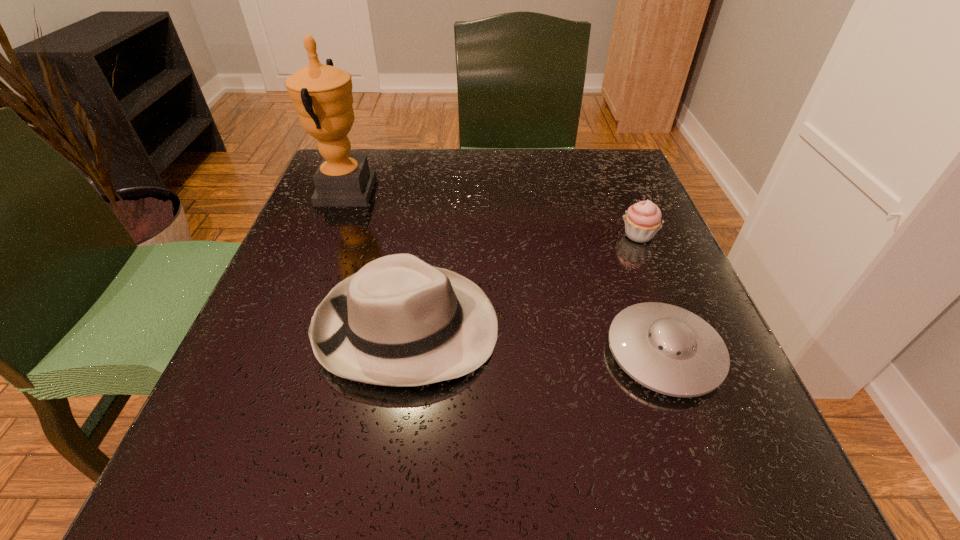
At what (x,y) coordinates should I click in order to perform the action: click on vacant area at the near left corner of the desktop. Please return your answer as a coordinate pair (x, y). The width and height of the screenshot is (960, 540). Looking at the image, I should click on (213, 451).

At what (x,y) coordinates should I click in order to perform the action: click on vacant space at the far right corner of the desktop. Please return your answer as a coordinate pair (x, y). Image resolution: width=960 pixels, height=540 pixels. Looking at the image, I should click on (571, 159).

Where is `free area in between the shortest object and the farthest object`? This screenshot has width=960, height=540. free area in between the shortest object and the farthest object is located at coordinates (504, 273).

Find the location of `free space between the fedora and the third tallest object`. free space between the fedora and the third tallest object is located at coordinates (523, 281).

Identify the location of unoccupied area between the second farthest object and the saucer. (651, 294).

Locate an element on the screen. This screenshot has height=540, width=960. vacant area that lies between the shortest object and the tallest object is located at coordinates (504, 273).

Locate an element on the screen. Image resolution: width=960 pixels, height=540 pixels. free spot between the second tallest object and the shortest object is located at coordinates (536, 340).

Locate an element on the screen. unoccupied area between the cupcake and the fedora is located at coordinates (523, 281).

This screenshot has height=540, width=960. I want to click on vacant space in between the third tallest object and the saucer, so click(651, 294).

Find the location of a particular element. free space between the third tallest object and the shortest object is located at coordinates (651, 294).